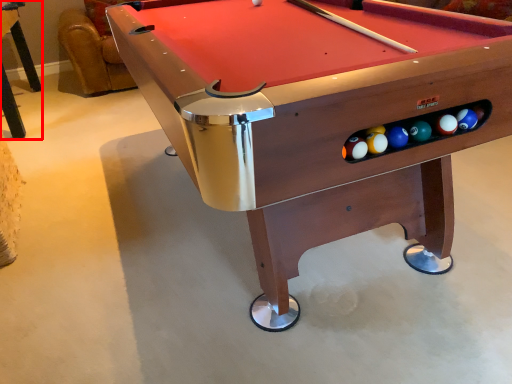
Question: From the image's perspective, considering the relative positions of table (annotated by the red box) and billiard table in the image provided, where is table (annotated by the red box) located with respect to the staircase?

Choices:
 (A) above
 (B) below

Answer: (A)